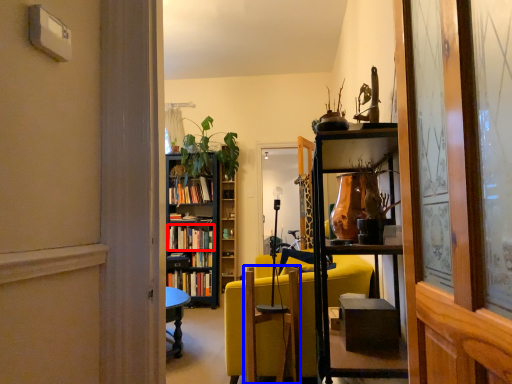
Question: Which object appears closest to the camera in this image, book (highlighted by a red box) or swivel chair (highlighted by a blue box)?

Choices:
 (A) book
 (B) swivel chair

Answer: (B)